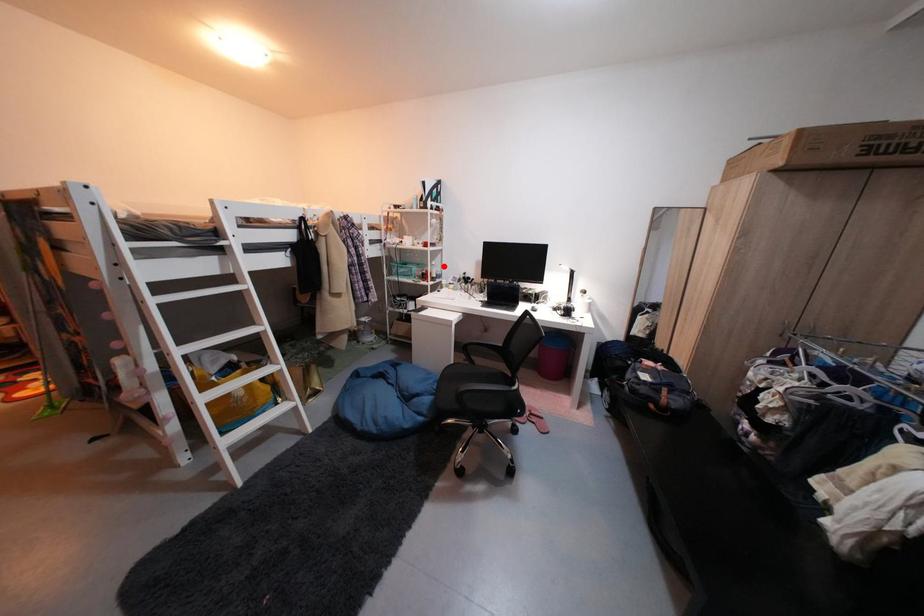
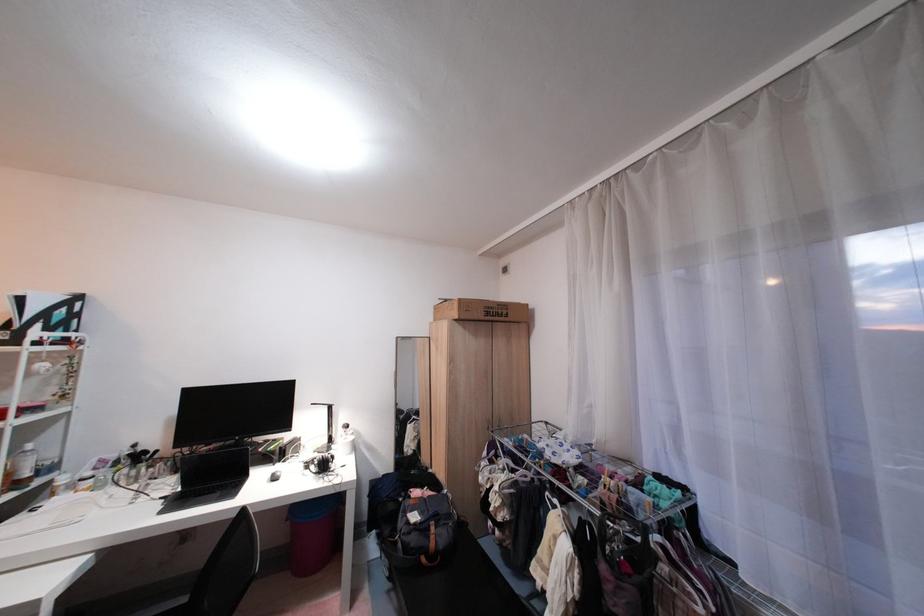
Locate, in the second image, the point that corresponds to the highlighted location in the first image.

(35, 453)